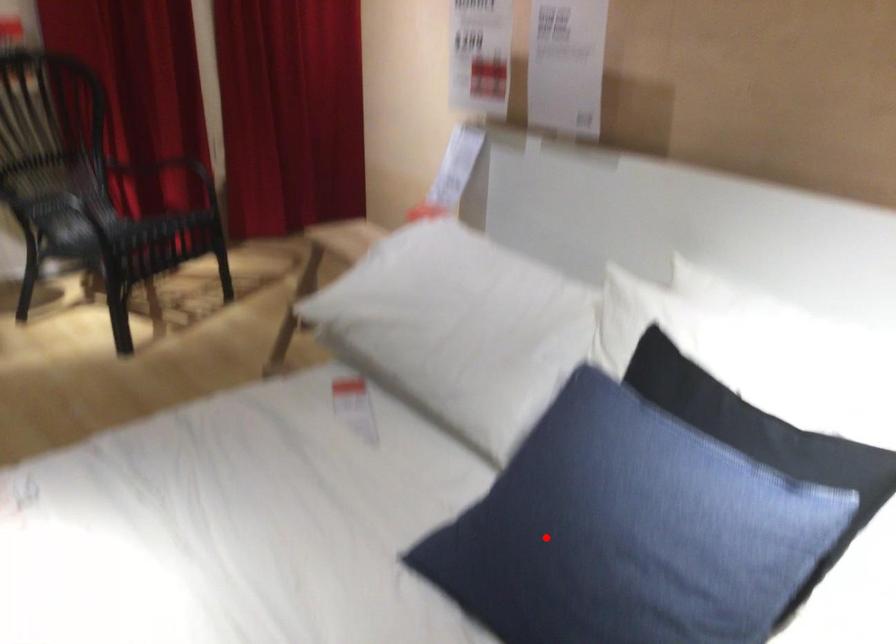
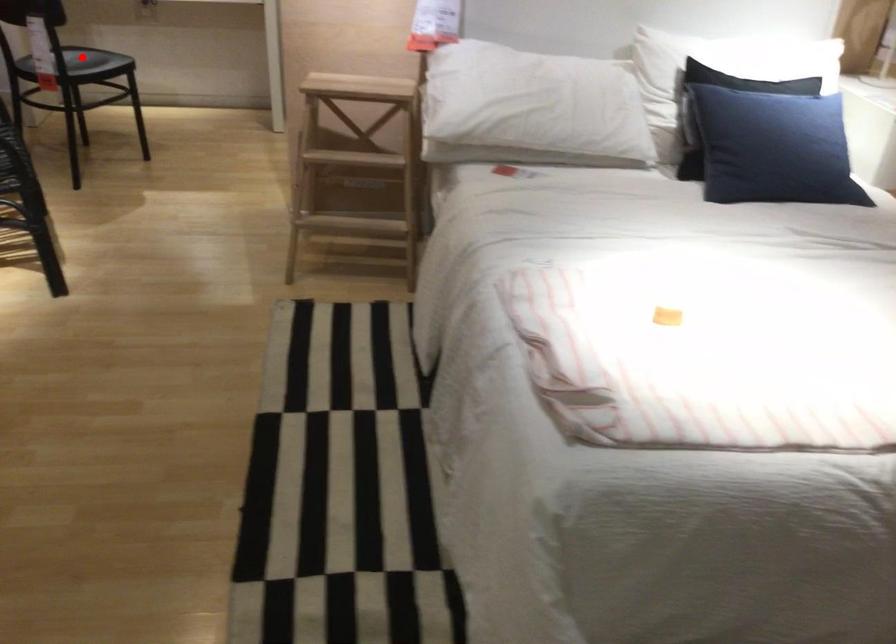
I am providing you with two images of the same scene from different viewpoints. A red point is marked on the first image and another point is marked on the second image. Are the points marked in image1 and image2 representing the same 3D position?

No